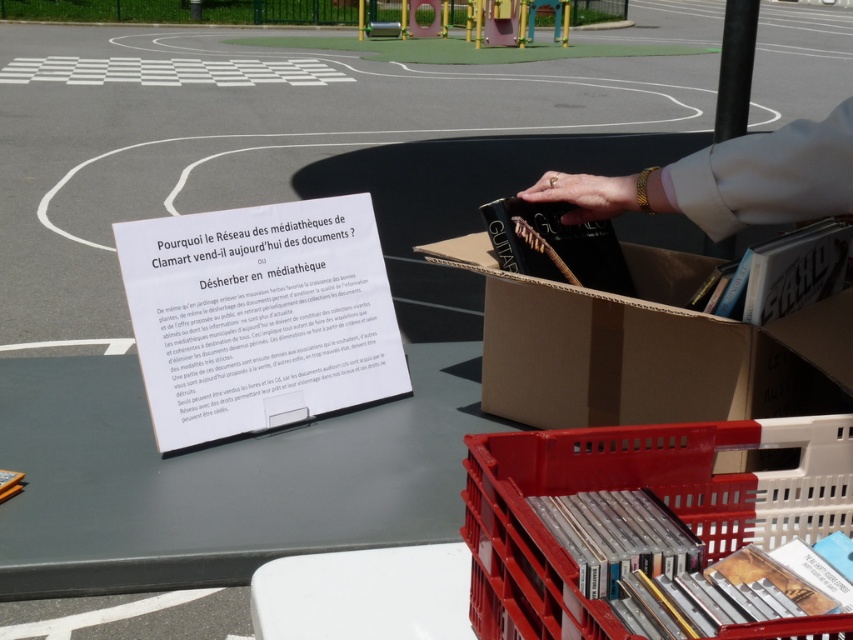
Question: In this image, where is red plastic crate at lower right located relative to gold bracelet at upper right?

Choices:
 (A) right
 (B) left

Answer: (B)

Question: Is red plastic crate at lower right to the left of gold bracelet at upper right from the viewer's perspective?

Choices:
 (A) yes
 (B) no

Answer: (A)

Question: Which object is farther from the camera taking this photo?

Choices:
 (A) gold bracelet at upper right
 (B) brown cardboard box at center
 (C) red plastic crate at lower right

Answer: (A)

Question: Which of the following is the closest to the observer?

Choices:
 (A) (714, 209)
 (B) (567, 605)

Answer: (B)

Question: Does brown cardboard box at center appear under gold bracelet at upper right?

Choices:
 (A) no
 (B) yes

Answer: (B)

Question: Considering the real-world distances, which object is closest to the gold bracelet at upper right?

Choices:
 (A) red plastic crate at lower right
 (B) brown cardboard box at center

Answer: (B)